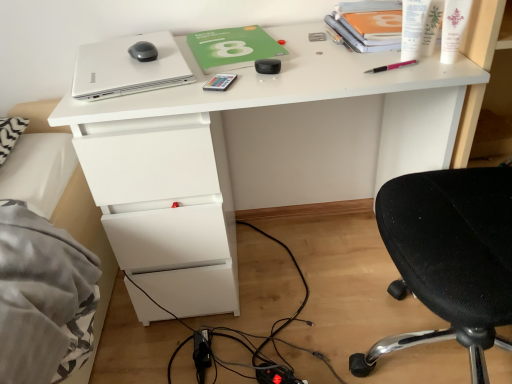
Where is `vacant area to the left of pink plastic pen at upper right, the second stationery in the left-to-right sequence`? vacant area to the left of pink plastic pen at upper right, the second stationery in the left-to-right sequence is located at coordinates (318, 71).